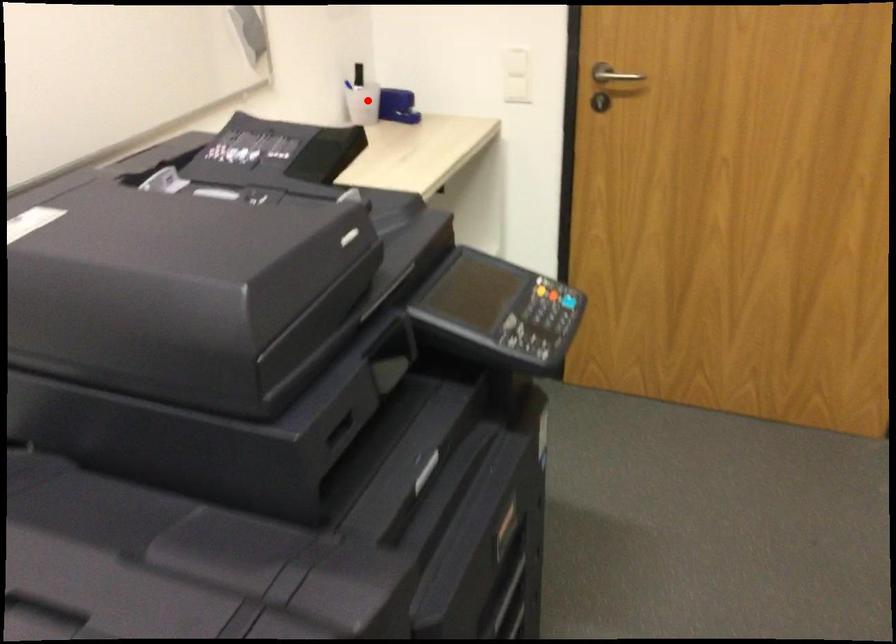
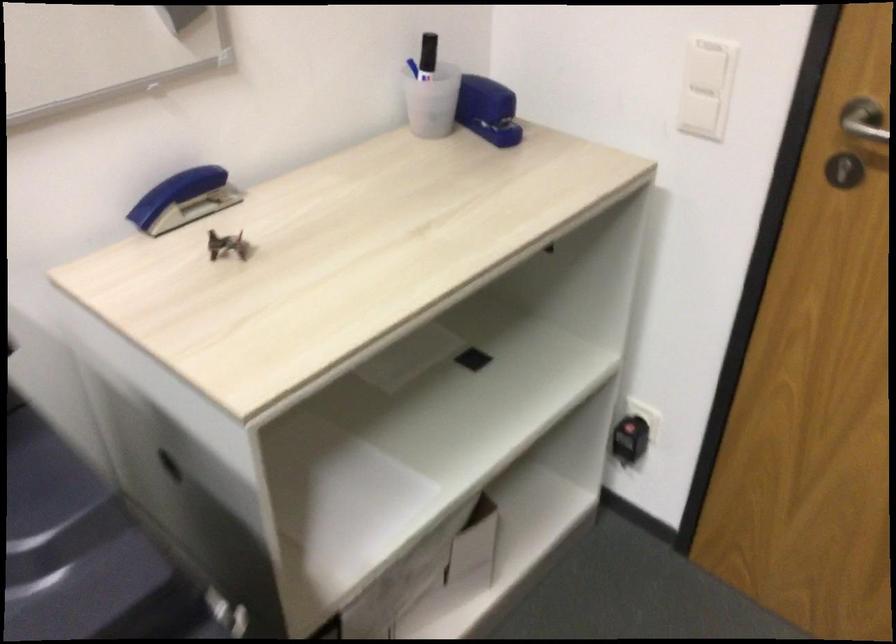
In the second image, find the point that corresponds to the highlighted location in the first image.

(428, 102)